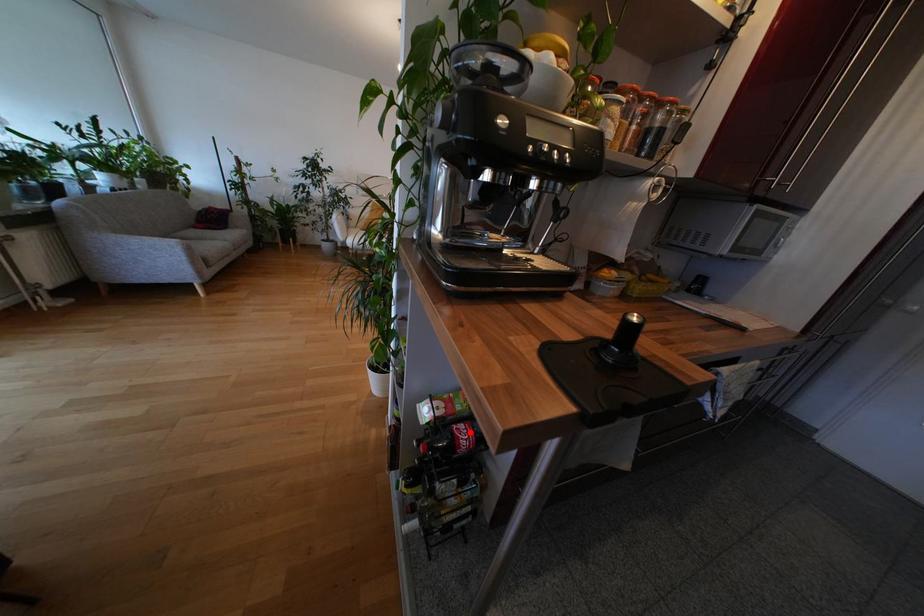
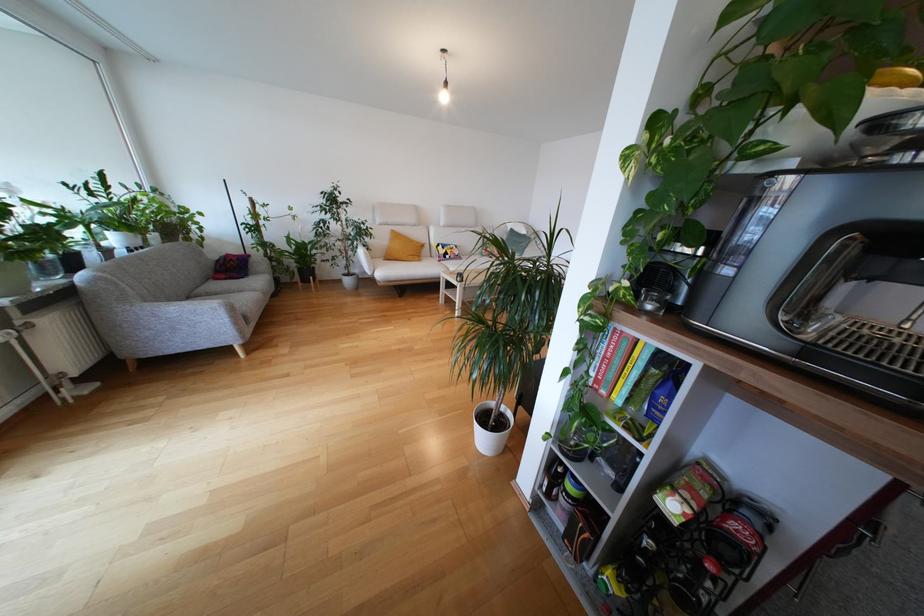
Question: I am providing you with two images of the same scene from different viewpoints. A red point is shown in image1. For the corresponding object point in image2, is it positioned nearer or farther from the camera?

Choices:
 (A) Nearer
 (B) Farther

Answer: (A)